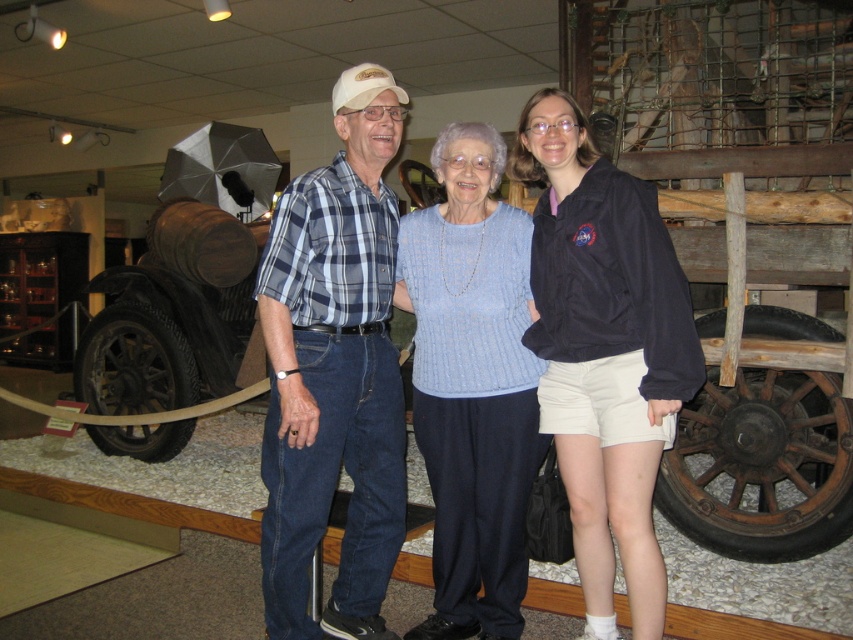
Question: Observing the image, what is the correct spatial positioning of light blue sweater at center in reference to light blue knitted sweater at center?

Choices:
 (A) below
 (B) above

Answer: (B)

Question: Can you confirm if light blue knitted sweater at center is positioned above rusty wood wagon at center?

Choices:
 (A) no
 (B) yes

Answer: (B)

Question: Does blue plaid shirt at center appear under light blue knitted sweater at center?

Choices:
 (A) no
 (B) yes

Answer: (A)

Question: Which of the following is the closest to the observer?

Choices:
 (A) (816, 492)
 (B) (438, 170)
 (C) (601, 291)
 (D) (375, 458)

Answer: (C)

Question: Among these objects, which one is farthest from the camera?

Choices:
 (A) rusty wood wagon at center
 (B) light blue knitted sweater at center
 (C) black fabric jacket at center
 (D) light blue sweater at center

Answer: (A)

Question: Which of the following is the closest to the observer?

Choices:
 (A) black fabric jacket at center
 (B) rusty wood wagon at center
 (C) light blue knitted sweater at center
 (D) blue plaid shirt at center

Answer: (A)